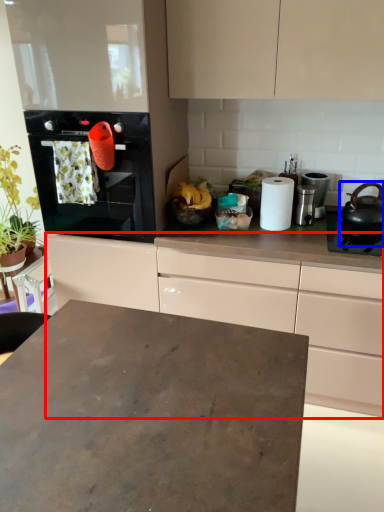
Question: Which object appears farthest to the camera in this image, cabinetry (highlighted by a red box) or kitchen appliance (highlighted by a blue box)?

Choices:
 (A) cabinetry
 (B) kitchen appliance

Answer: (B)